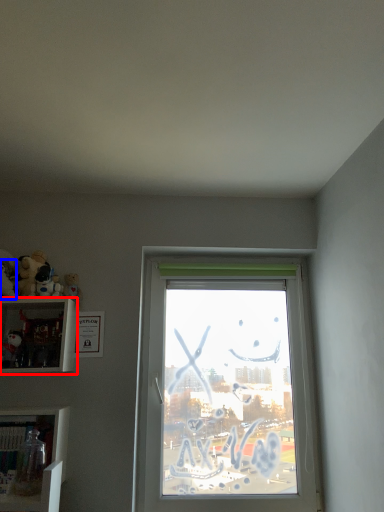
Question: Which of the following is the closest to the observer, shelf (highlighted by a red box) or toy (highlighted by a blue box)?

Choices:
 (A) shelf
 (B) toy

Answer: (A)